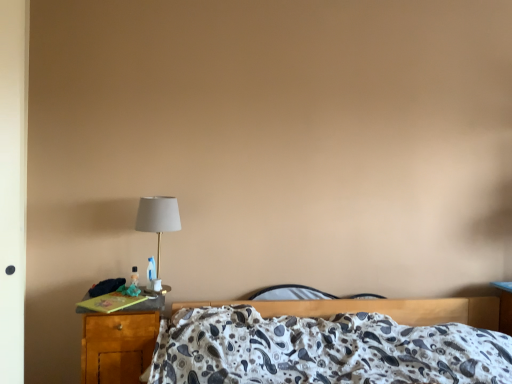
Question: Does point (442, 311) appear closer or farther from the camera than point (131, 312)?

Choices:
 (A) closer
 (B) farther

Answer: (B)

Question: Would you say patterned fabric bed at center is inside or outside wooden nightstand at lower left?

Choices:
 (A) inside
 (B) outside

Answer: (B)

Question: Estimate the real-world distances between objects in this image. Which object is closer to the patterned fabric bed at center?

Choices:
 (A) wooden nightstand at lower left
 (B) matte gold table lamp at left

Answer: (A)

Question: Which of these objects is positioned closest to the patterned fabric bed at center?

Choices:
 (A) matte gold table lamp at left
 (B) wooden nightstand at lower left

Answer: (B)